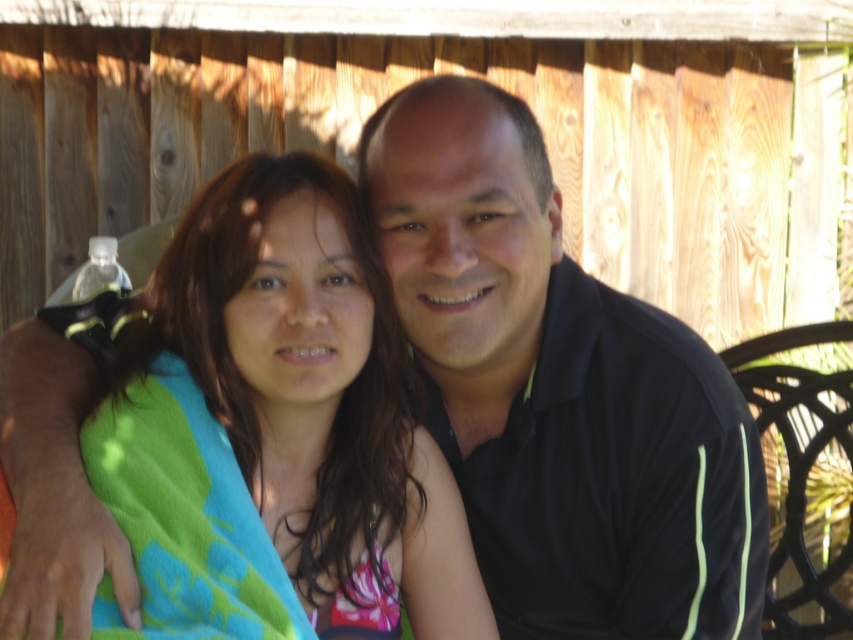
In the scene shown: You are standing in front of the two people in the image. You want to throw a frisbee to one of them. Which point, point (451, 168) or point (338, 410), is closer to you so you can aim more accurately?

Point (451, 168) is closer to the viewer than point (338, 410), so you should aim for that point to throw the frisbee more accurately.

You are standing in the backyard and want to hand the water bottle to the person wearing the black smooth shirt at center. Based on their position, where should you approach from to ensure you can reach them without moving the shirt out of the way?

The black smooth shirt at center is located at point (x=560, y=390), so you should approach from the right side to ensure you can reach them without moving the shirt out of the way.